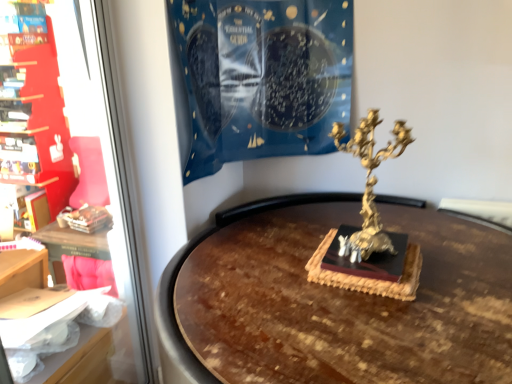
Question: Can you confirm if blue fabric at upper center is thinner than gold metallic candelabra at center-right?

Choices:
 (A) no
 (B) yes

Answer: (A)

Question: Is blue fabric at upper center to the left of gold metallic candelabra at center-right from the viewer's perspective?

Choices:
 (A) yes
 (B) no

Answer: (A)

Question: Is blue fabric at upper center bigger than gold metallic candelabra at center-right?

Choices:
 (A) no
 (B) yes

Answer: (B)

Question: From the image's perspective, does blue fabric at upper center appear higher than gold metallic candelabra at center-right?

Choices:
 (A) yes
 (B) no

Answer: (A)

Question: Is blue fabric at upper center far away from gold metallic candelabra at center-right?

Choices:
 (A) no
 (B) yes

Answer: (A)

Question: Is blue fabric at upper center touching gold metallic candelabra at center-right?

Choices:
 (A) no
 (B) yes

Answer: (A)

Question: Is matte red bookshelf at left positioned with its back to matte red bookshelf at left?

Choices:
 (A) no
 (B) yes

Answer: (A)

Question: Does matte red bookshelf at left have a lesser width compared to matte red bookshelf at left?

Choices:
 (A) no
 (B) yes

Answer: (B)

Question: Considering the relative sizes of matte red bookshelf at left and matte red bookshelf at left in the image provided, is matte red bookshelf at left smaller than matte red bookshelf at left?

Choices:
 (A) no
 (B) yes

Answer: (B)

Question: Is matte red bookshelf at left directly adjacent to matte red bookshelf at left?

Choices:
 (A) no
 (B) yes

Answer: (B)

Question: Is matte red bookshelf at left outside matte red bookshelf at left?

Choices:
 (A) no
 (B) yes

Answer: (B)

Question: Does matte red bookshelf at left have a greater width compared to matte red bookshelf at left?

Choices:
 (A) yes
 (B) no

Answer: (B)

Question: Does gold metallic candelabra at center-right have a greater height compared to matte red bookshelf at left?

Choices:
 (A) no
 (B) yes

Answer: (A)